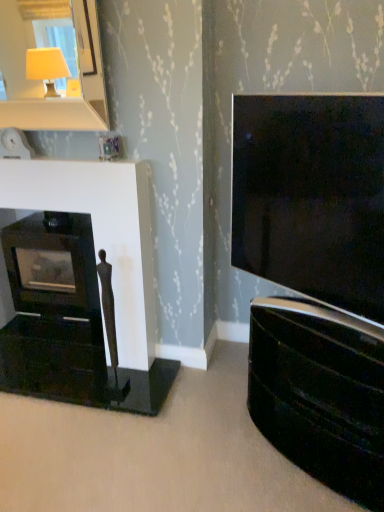
Where is `free region under white glossy mirror at upper left (from a real-world perspective)`? Image resolution: width=384 pixels, height=512 pixels. free region under white glossy mirror at upper left (from a real-world perspective) is located at coordinates (61, 157).